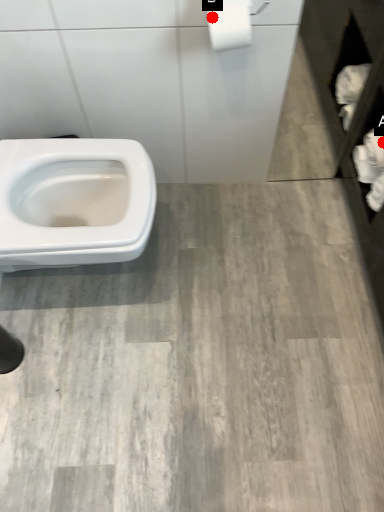
Question: Two points are circled on the image, labeled by A and B beside each circle. Which point is closer to the camera taking this photo?

Choices:
 (A) A is closer
 (B) B is closer

Answer: (B)